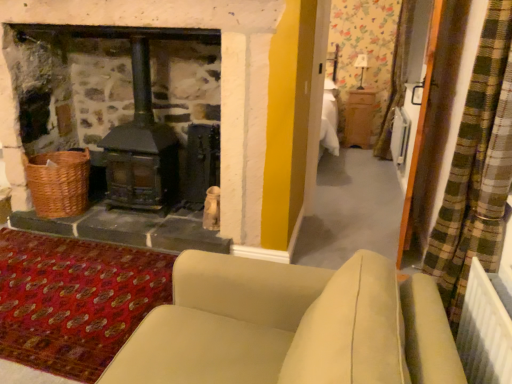
You are a GUI agent. You are given a task and a screenshot of the screen. Output one action in this format:
    pyautogui.click(x=<x>, y=<y>)
    Task: Click on the vacant area to the left of white plastic screen door at right
    This screenshot has height=384, width=512.
    Given the screenshot: What is the action you would take?
    pyautogui.click(x=339, y=237)